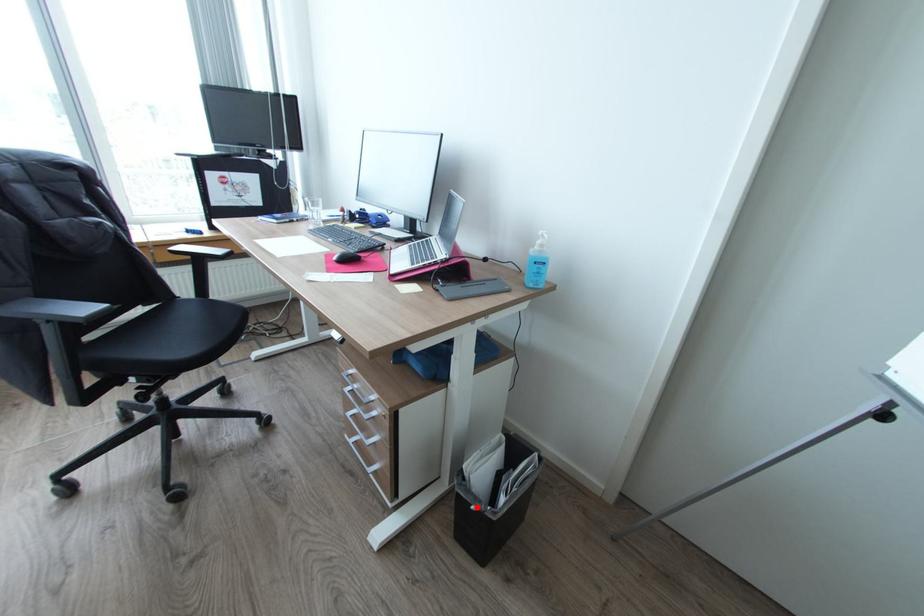
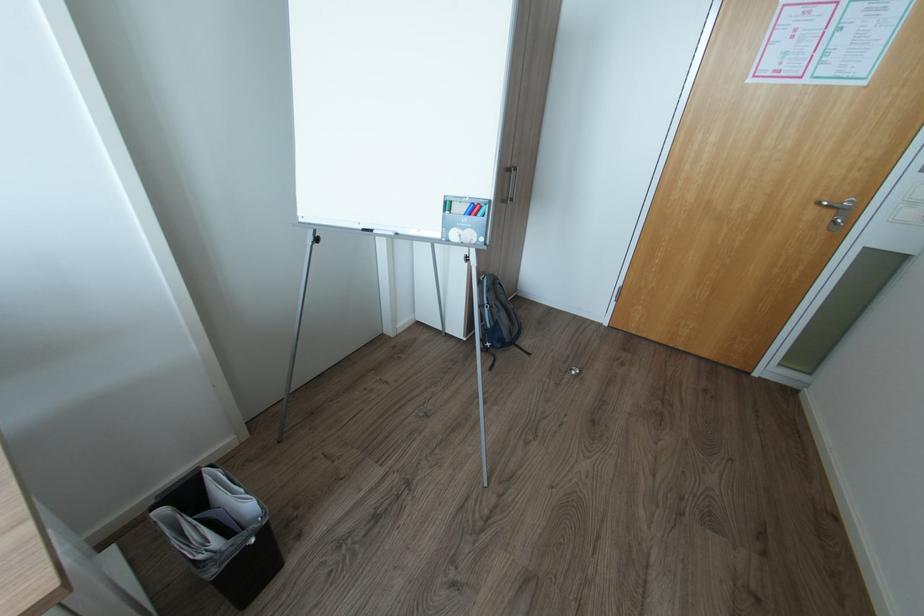
Find the pixel in the second image that matches the highlighted location in the first image.

(257, 541)